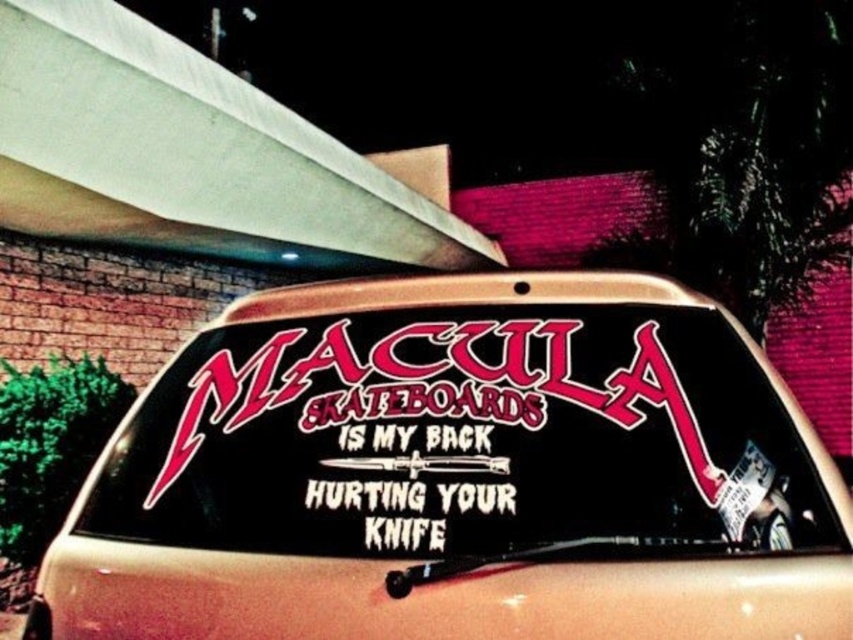
Question: Is black matte sticker at center to the right of white paper sticker at lower right from the viewer's perspective?

Choices:
 (A) no
 (B) yes

Answer: (A)

Question: Estimate the real-world distances between objects in this image. Which object is closer to the white paper sticker at lower right?

Choices:
 (A) white vinyl text at center
 (B) black matte sticker at center

Answer: (B)

Question: Does black matte sticker at center come behind white paper sticker at lower right?

Choices:
 (A) no
 (B) yes

Answer: (A)

Question: Based on their relative distances, which object is nearer to the white paper sticker at lower right?

Choices:
 (A) black matte sticker at center
 (B) white vinyl text at center

Answer: (A)

Question: Based on their relative distances, which object is nearer to the black matte sticker at center?

Choices:
 (A) white paper sticker at lower right
 (B) white vinyl text at center

Answer: (B)

Question: Where is white vinyl text at center located in relation to white paper sticker at lower right in the image?

Choices:
 (A) below
 (B) above

Answer: (A)